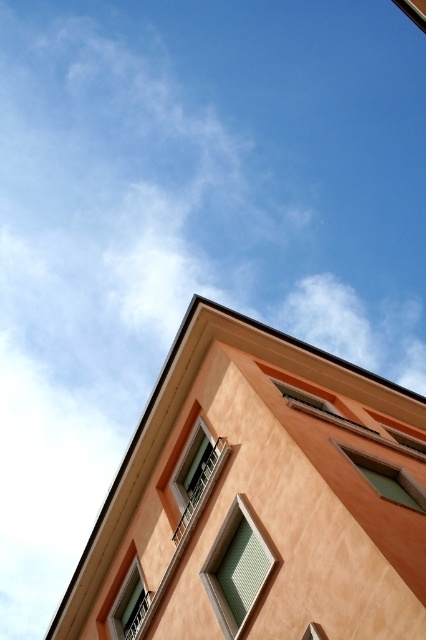
Question: Does green glass window at lower right have a lesser width compared to matte glass window at lower left?

Choices:
 (A) no
 (B) yes

Answer: (A)

Question: Which is farther from the matte glass window at lower left?

Choices:
 (A) green mesh window at center
 (B) green glass window at lower right

Answer: (B)

Question: Which point appears farthest from the camera in this image?

Choices:
 (A) (238, 572)
 (B) (115, 621)
 (C) (403, 493)

Answer: (B)

Question: Which object is positioned farthest from the green mesh window at center?

Choices:
 (A) green glass window at lower right
 (B) matte glass window at center

Answer: (A)

Question: Does green glass window at lower right have a smaller size compared to matte glass window at lower left?

Choices:
 (A) yes
 (B) no

Answer: (B)

Question: Is green mesh window at center bigger than matte glass window at center?

Choices:
 (A) yes
 (B) no

Answer: (A)